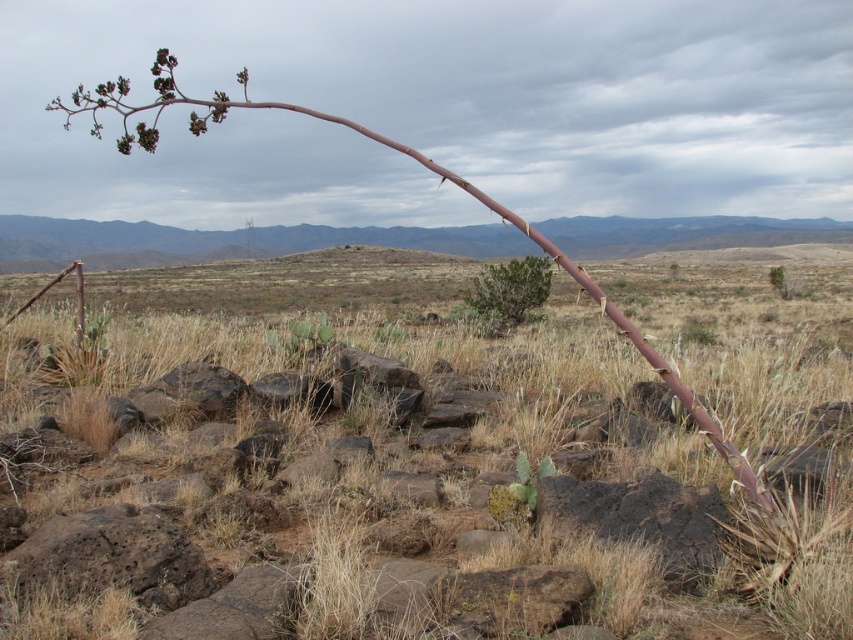
Is point (564, 296) closer to camera compared to point (207, 104)?

No.

Does brown grass at center appear under brown rough branch at left?

Yes, brown grass at center is below brown rough branch at left.

Between point (273, 465) and point (721, 451), which one is positioned behind?

The point (273, 465) is behind.

I want to click on brown grass at center, so click(413, 480).

Is brown grass at center above green leafy bush at center?

Actually, brown grass at center is below green leafy bush at center.

Is point (346, 605) in front of point (476, 305)?

Yes, it is.

The height and width of the screenshot is (640, 853). What are the coordinates of `brown grass at center` in the screenshot? It's located at (413, 480).

Between brown rough branch at left and green leafy bush at center, which one is positioned lower?

green leafy bush at center is lower down.

Can you confirm if brown rough branch at left is positioned to the right of green leafy bush at center?

In fact, brown rough branch at left is to the left of green leafy bush at center.

Image resolution: width=853 pixels, height=640 pixels. What are the coordinates of `brown rough branch at left` in the screenshot? It's located at (418, 163).

The width and height of the screenshot is (853, 640). Find the location of `brown rough branch at left`. brown rough branch at left is located at coordinates (418, 163).